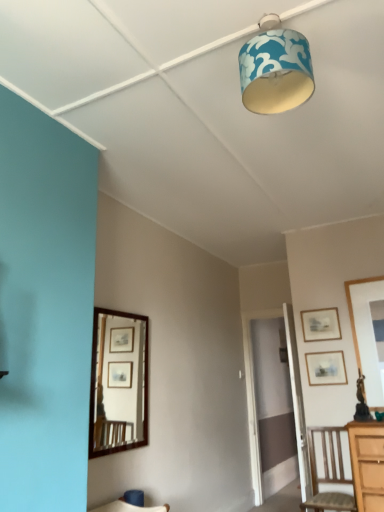
Question: Is blue fabric lampshade at upper center taller or shorter than wooden chair at lower right?

Choices:
 (A) short
 (B) tall

Answer: (A)

Question: Choose the correct answer: Is blue fabric lampshade at upper center inside wooden chair at lower right or outside it?

Choices:
 (A) inside
 (B) outside

Answer: (B)

Question: Estimate the real-world distances between objects in this image. Which object is closer to the brown wooden mirror at left?

Choices:
 (A) matte wooden picture frame at right, the 1th picture frame ordered from the bottom
 (B) blue fabric lampshade at upper center
 (C) wooden picture frame at upper right, positioned as the first picture frame in top-to-bottom order
 (D) wooden chair at lower right

Answer: (D)

Question: Which of these objects is positioned closest to the wooden chair at lower right?

Choices:
 (A) matte wooden picture frame at right, the 1th picture frame ordered from the bottom
 (B) blue fabric lampshade at upper center
 (C) brown wooden mirror at left
 (D) wooden picture frame at upper right, the second picture frame ordered from the bottom

Answer: (A)